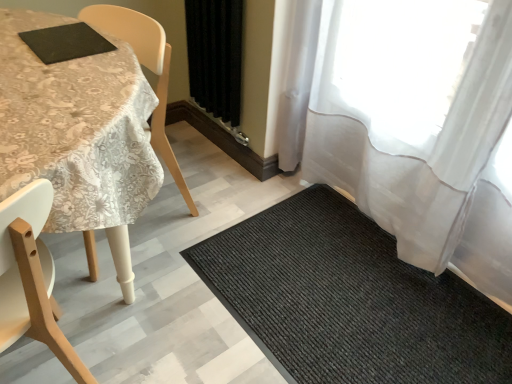
Question: From a real-world perspective, is sheer white curtain at right, placed as the 2th curtain when sorted from left to right, over black textured mat at lower right?

Choices:
 (A) yes
 (B) no

Answer: (A)

Question: Can you confirm if sheer white curtain at right, placed as the 2th curtain when sorted from left to right, is bigger than black textured mat at lower right?

Choices:
 (A) yes
 (B) no

Answer: (A)

Question: Considering the relative positions of sheer white curtain at right, placed as the 2th curtain when sorted from left to right, and black textured mat at lower right in the image provided, is sheer white curtain at right, placed as the 2th curtain when sorted from left to right, to the right of black textured mat at lower right from the viewer's perspective?

Choices:
 (A) no
 (B) yes

Answer: (B)

Question: Is there a large distance between sheer white curtain at right, placed as the 2th curtain when sorted from left to right, and black textured mat at lower right?

Choices:
 (A) no
 (B) yes

Answer: (A)

Question: Is sheer white curtain at right, the first curtain viewed from the right, completely or partially outside of black textured mat at lower right?

Choices:
 (A) no
 (B) yes

Answer: (B)

Question: Does sheer white curtain at right, placed as the 2th curtain when sorted from left to right, have a greater width compared to black textured mat at lower right?

Choices:
 (A) no
 (B) yes

Answer: (A)

Question: Does black textured mat at lower right turn towards black fabric curtain at center, which ranks as the 2th curtain in right-to-left order?

Choices:
 (A) no
 (B) yes

Answer: (A)

Question: From a real-world perspective, does black textured mat at lower right stand above black fabric curtain at center, positioned as the first curtain in left-to-right order?

Choices:
 (A) yes
 (B) no

Answer: (B)

Question: Considering the relative sizes of black textured mat at lower right and black fabric curtain at center, positioned as the first curtain in left-to-right order, in the image provided, is black textured mat at lower right taller than black fabric curtain at center, positioned as the first curtain in left-to-right order,?

Choices:
 (A) yes
 (B) no

Answer: (B)

Question: Is black textured mat at lower right positioned with its back to black fabric curtain at center, positioned as the first curtain in left-to-right order?

Choices:
 (A) no
 (B) yes

Answer: (A)

Question: Are black textured mat at lower right and black fabric curtain at center, which ranks as the 2th curtain in right-to-left order, far apart?

Choices:
 (A) yes
 (B) no

Answer: (B)

Question: From the image's perspective, is black textured mat at lower right on black fabric curtain at center, which ranks as the 2th curtain in right-to-left order?

Choices:
 (A) no
 (B) yes

Answer: (A)

Question: Is wooden chair at left shorter than black textured mat at lower right?

Choices:
 (A) yes
 (B) no

Answer: (B)